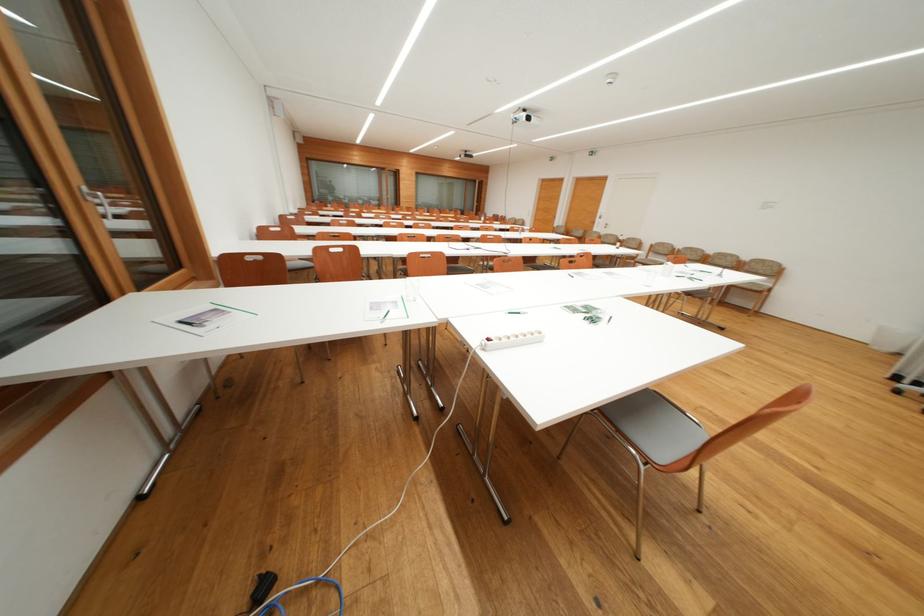
Find where to turn the silver window handle. Please return your answer as a coordinate pair (x, y).

(98, 201)